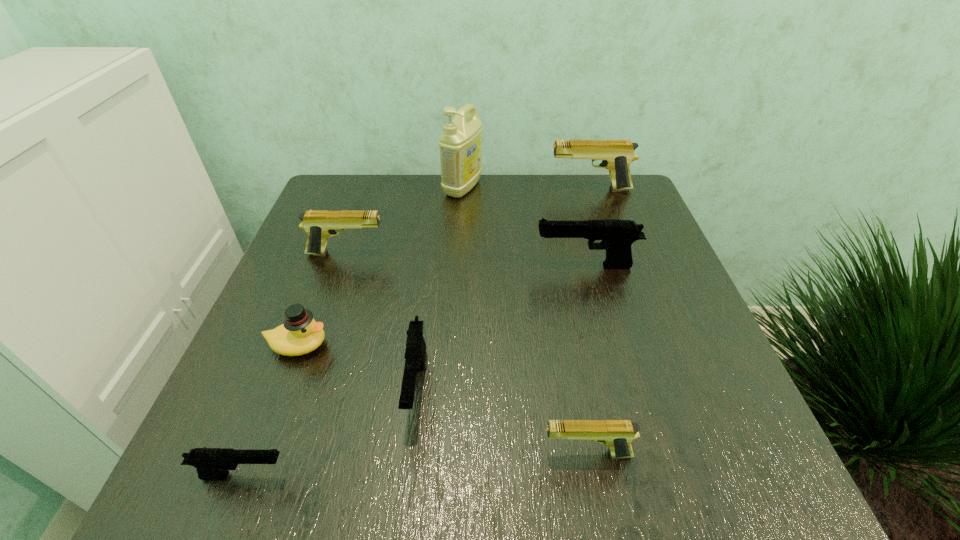
Find the location of a particular element. duck is located at coordinates (299, 334).

Identify the location of the smallest tan pistol. (616, 434).

At what (x,y) coordinates should I click in order to perform the action: click on the second nearest pistol. Please return your answer as a coordinate pair (x, y). Looking at the image, I should click on (616, 434).

Find the location of a particular element. The width and height of the screenshot is (960, 540). the nearest black pistol is located at coordinates (211, 463).

Locate an element on the screen. the nearest pistol is located at coordinates (211, 463).

This screenshot has height=540, width=960. Identify the location of vacant area located on the left of the tallest object. (363, 188).

Where is `vacant region located at the barrel of the farthest pistol`? The image size is (960, 540). vacant region located at the barrel of the farthest pistol is located at coordinates (443, 190).

Find the location of `free location located 0.050m at the barrel of the farthest pistol`. free location located 0.050m at the barrel of the farthest pistol is located at coordinates (531, 190).

Identify the location of free space located 0.390m at the barrel of the farthest pistol. pyautogui.click(x=406, y=190).

This screenshot has height=540, width=960. I want to click on free space located 0.370m on the front-facing side of the rightmost black pistol, so click(368, 266).